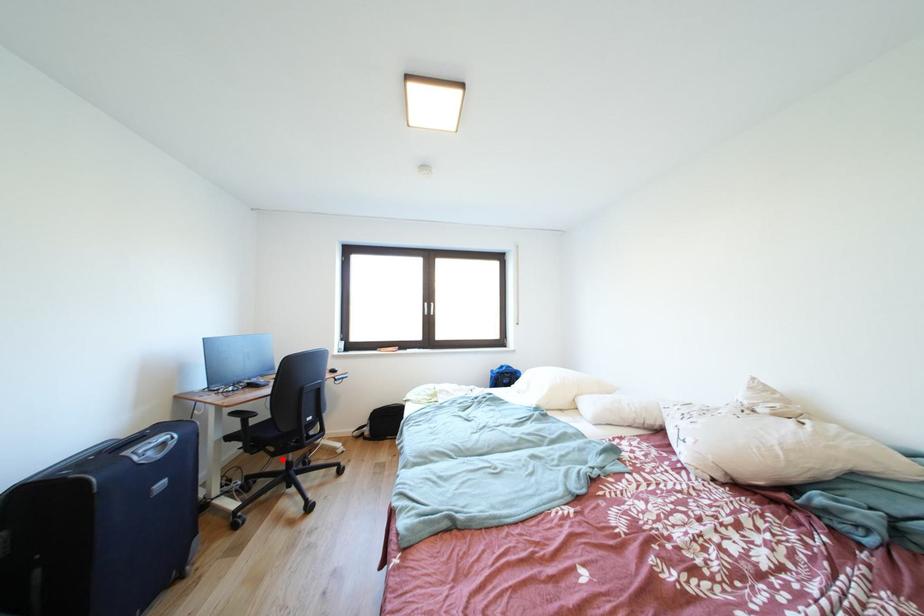
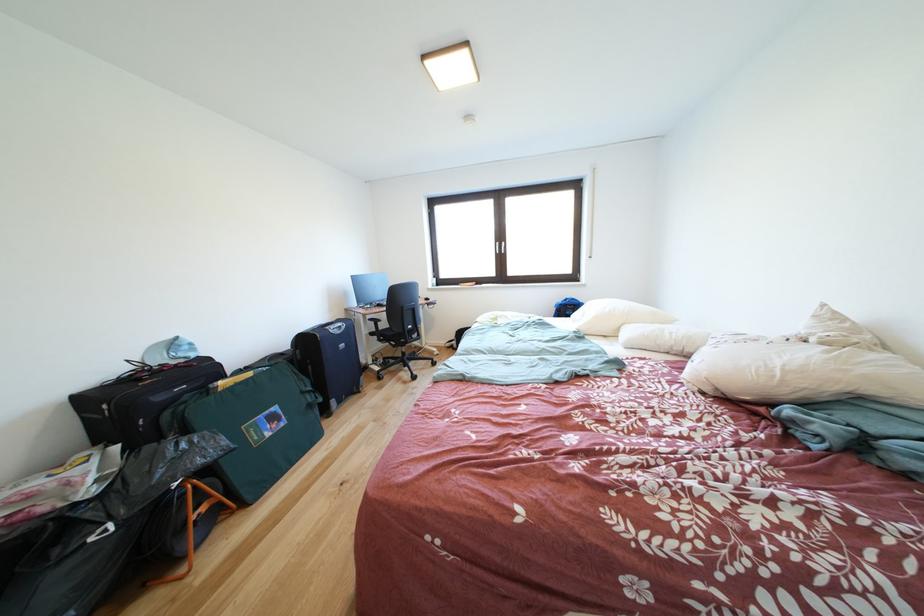
In the second image, find the point that corresponds to the highlighted location in the first image.

(403, 351)